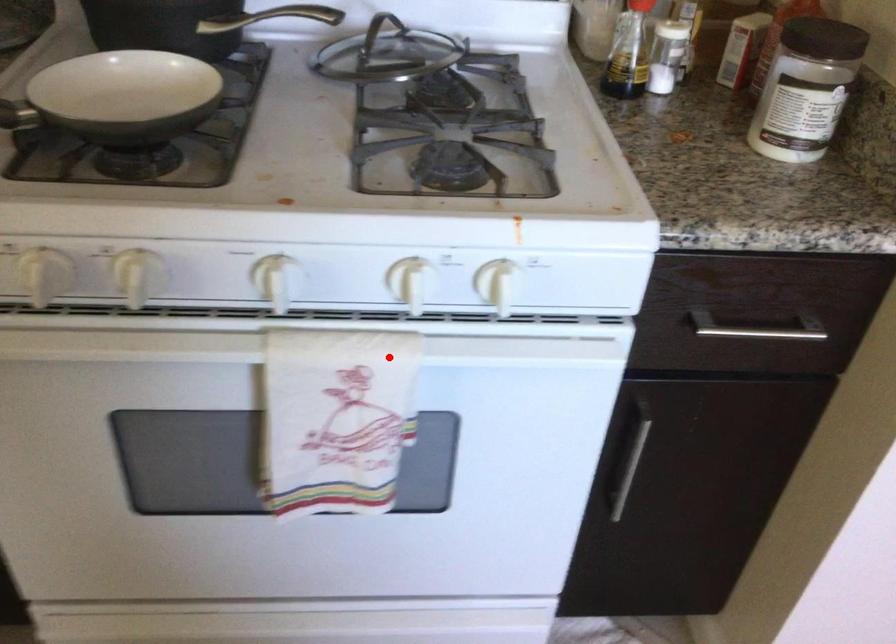
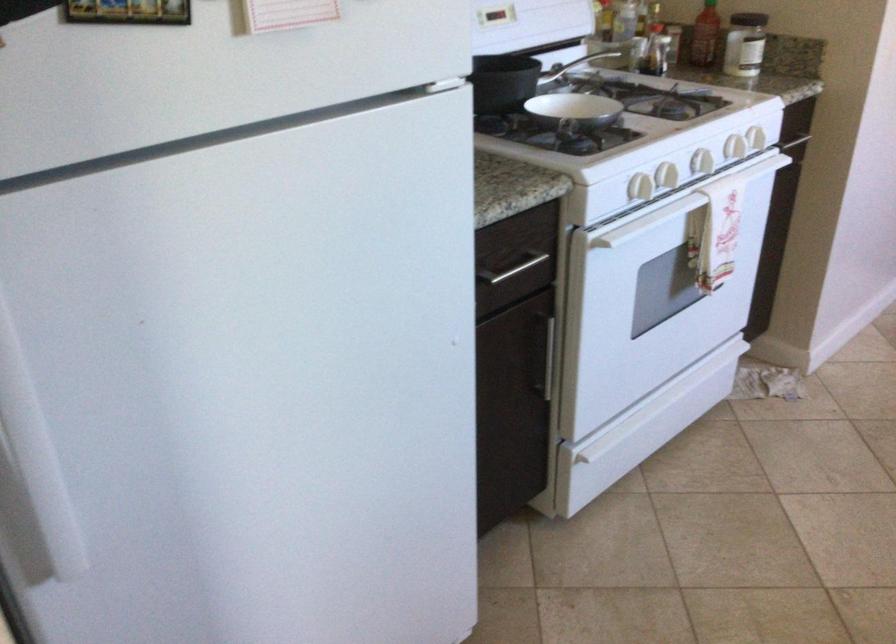
Question: A red point is marked in image1. In image2, is the corresponding 3D point closer to the camera or farther? Reply with the corresponding letter.

Choices:
 (A) The corresponding 3D point is closer.
 (B) The corresponding 3D point is farther.

Answer: (B)